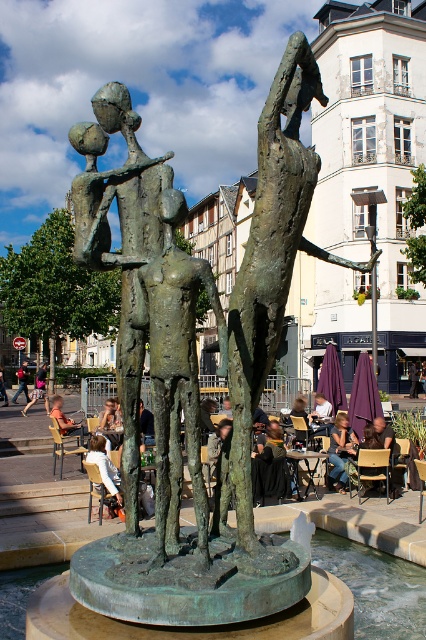
Question: Which point is farther from the camera taking this photo?

Choices:
 (A) (40, 371)
 (B) (17, 374)

Answer: (A)

Question: Among these points, which one is farthest from the camera?

Choices:
 (A) (43, 384)
 (B) (345, 449)

Answer: (A)

Question: Does light brown wooden chair at lower left appear under matte bronze statue at center?

Choices:
 (A) no
 (B) yes

Answer: (A)

Question: Is denim jeans at center to the left of matte bronze statue at center from the viewer's perspective?

Choices:
 (A) no
 (B) yes

Answer: (A)

Question: Which point is farther to the camera?

Choices:
 (A) matte bronze statue at center
 (B) light brown wooden chair at lower left
 (C) denim jeans at center
 (D) bronze statue at center

Answer: (A)

Question: Can you confirm if bronze statue at center is thinner than matte bronze statue at center?

Choices:
 (A) yes
 (B) no

Answer: (A)